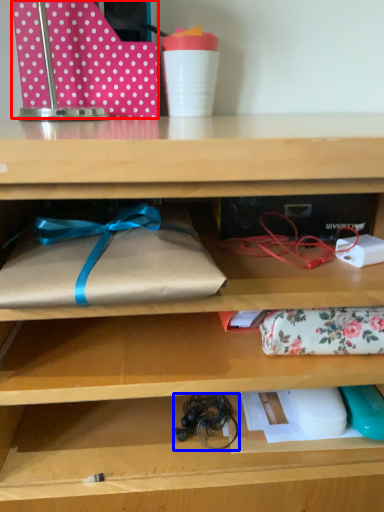
Question: Which object is closer to the camera taking this photo, wrapping paper (highlighted by a red box) or twine (highlighted by a blue box)?

Choices:
 (A) wrapping paper
 (B) twine

Answer: (B)